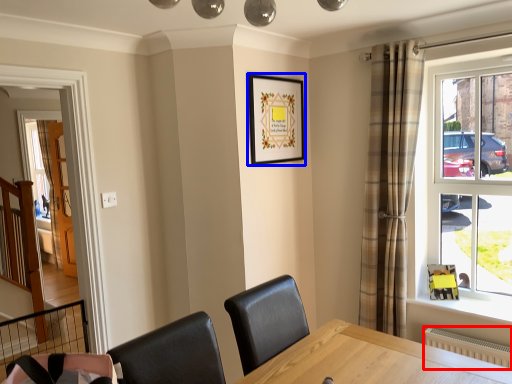
Question: Which point is closer to the camera, radiator (highlighted by a red box) or picture frame (highlighted by a blue box)?

Choices:
 (A) radiator
 (B) picture frame

Answer: (A)